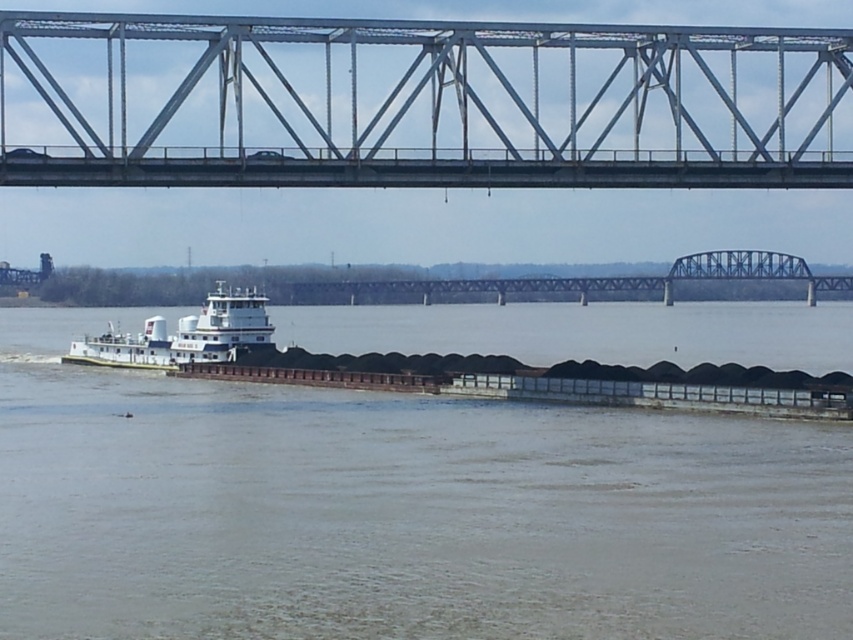
You are a river traffic controller and need to ensure that the brown matte barge at center can pass under the metal bridge at upper center. Based on the scene, can you confirm if the barge will fit under the bridge?

The brown matte barge at center might be wider than the metal bridge at upper center, so there is a risk that the barge may not fit under the bridge. Further measurements or clearance checks are needed to confirm.

You are a photographer taking a picture of the river scene. You notice the brown matte barge at center and the white matte barge at lower left. Which barge should you focus on to capture one that is closer to the camera?

The brown matte barge at center is in front of the white matte barge at lower left, so focusing on the brown matte barge at center will capture the one closer to the camera.

You are a crane operator on the barge transporting coal. You need to lift a heavy container from the barge and place it onto the metal bridge at upper center. The maximum reach of your crane is 50 meters. Can you safely perform this task without extending the crane beyond its limit?

The distance between the barge and the metal bridge at upper center is 53.70 meters. Since the crane has a maximum reach of 50 meters, it cannot safely perform the task as the distance exceeds its limit.